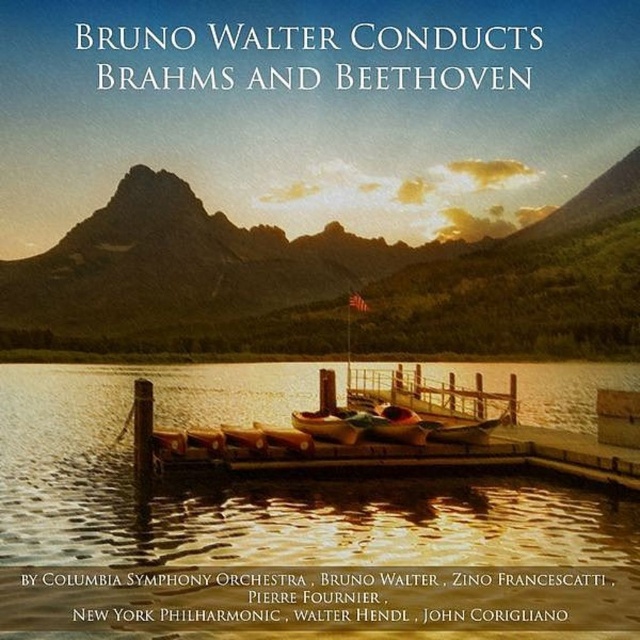
Between glistening water at dock center and green textured mountain at center, which one is positioned higher?

green textured mountain at center

Is glistening water at dock center closer to the viewer compared to green textured mountain at center?

Yes, glistening water at dock center is in front of green textured mountain at center.

Is point (29, 600) positioned in front of point (275, 296)?

Yes, point (29, 600) is closer to viewer.

In order to click on glistening water at dock center in this screenshot , I will do `click(268, 516)`.